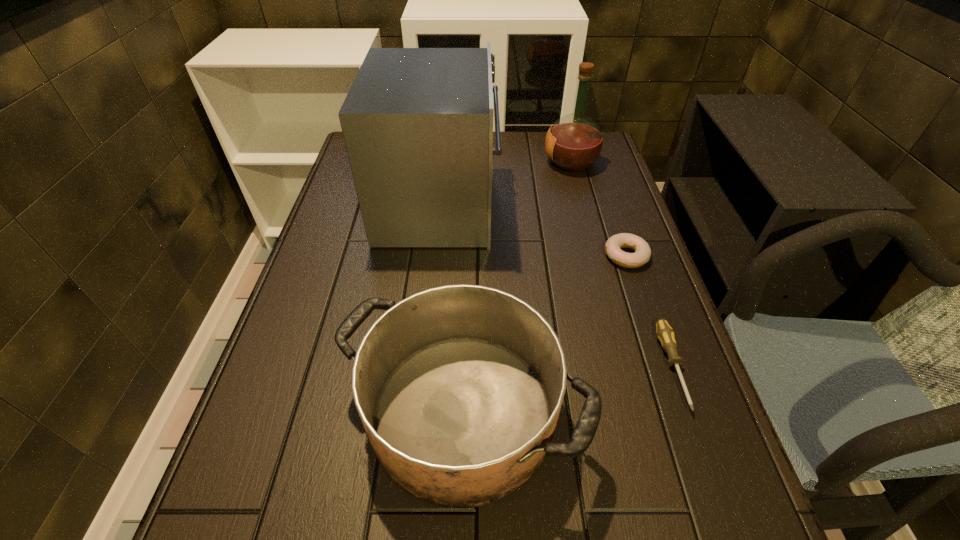
At what (x,y) coordinates should I click in order to perform the action: click on the second closest object to the tallest object. Please return your answer as a coordinate pair (x, y). The image size is (960, 540). Looking at the image, I should click on (642, 250).

At what (x,y) coordinates should I click in order to perform the action: click on object that is the closest to the second tallest object. Please return your answer as a coordinate pair (x, y). The height and width of the screenshot is (540, 960). Looking at the image, I should click on (417, 123).

In order to click on free location that satisfies the following two spatial constraints: 1. on the front panel of the tallest object; 2. on the right side of the third tallest object in this screenshot , I will do `click(417, 411)`.

Where is `free location that satisfies the following two spatial constraints: 1. on the front panel of the saucepan; 2. on the right side of the toaster oven`? This screenshot has width=960, height=540. free location that satisfies the following two spatial constraints: 1. on the front panel of the saucepan; 2. on the right side of the toaster oven is located at coordinates (417, 411).

Identify the location of vacant region that satisfies the following two spatial constraints: 1. on the front label of the fourth shortest object; 2. on the back side of the doughnut. This screenshot has height=540, width=960. (595, 256).

Locate an element on the screen. Image resolution: width=960 pixels, height=540 pixels. free space that satisfies the following two spatial constraints: 1. on the front label of the doughnut; 2. on the left side of the second tallest object is located at coordinates (595, 256).

The width and height of the screenshot is (960, 540). In order to click on vacant space that satisfies the following two spatial constraints: 1. on the front panel of the tallest object; 2. on the back side of the third shortest object in this screenshot , I will do `click(417, 411)`.

Find the location of a particular element. free region that satisfies the following two spatial constraints: 1. on the back side of the doughnut; 2. on the front label of the second tallest object is located at coordinates click(x=595, y=163).